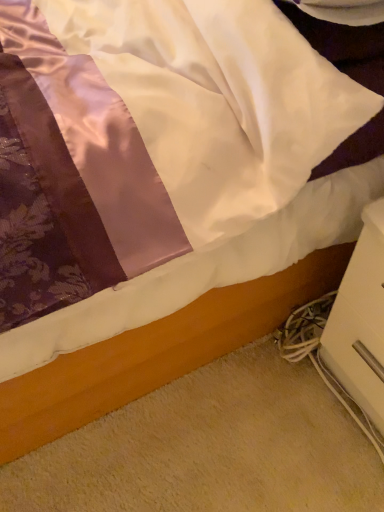
What is the approximate height of white plastic desktop computer at lower right?

white plastic desktop computer at lower right is 19.82 inches in height.

Image resolution: width=384 pixels, height=512 pixels. What do you see at coordinates (360, 321) in the screenshot?
I see `white plastic desktop computer at lower right` at bounding box center [360, 321].

What are the coordinates of `white plastic desktop computer at lower right` in the screenshot? It's located at coord(360,321).

This screenshot has width=384, height=512. I want to click on white plastic desktop computer at lower right, so click(360, 321).